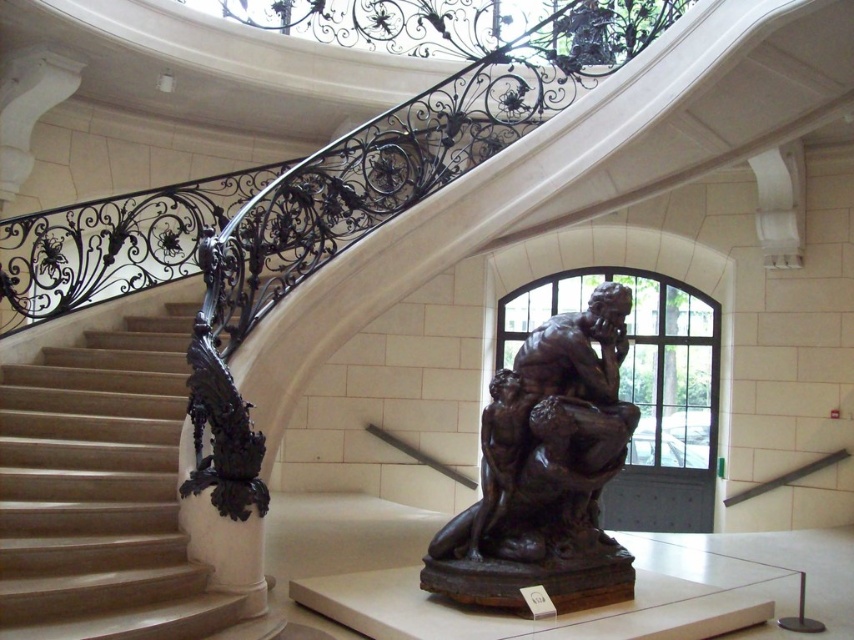
You are standing in the grand staircase area and want to take a photo. You notice two points in the scene labeled as point 1 at coordinates point (91, 604) and point 2 at coordinates point (512, 561). Which point will appear larger in your photo?

Point 1 at coordinates point (91, 604) will appear larger in the photo because it is closer to the camera than point 2 at coordinates point (512, 561).

You are standing in the entrance of this grand space and want to reach the bronze sculpture at center. Which direction should you move towards, considering the polished wood stairs at left are in your way?

The polished wood stairs at left are positioned over the bronze sculpture at center, so you should move towards the right side of the stairs to access the bronze sculpture at center.

You are standing in the center of the room and want to exit through the front door. The polished wood stairs at left are in your way. Can you walk around them to reach the door?

The polished wood stairs at left are located at point [103,492], so you can walk around them to reach the door.